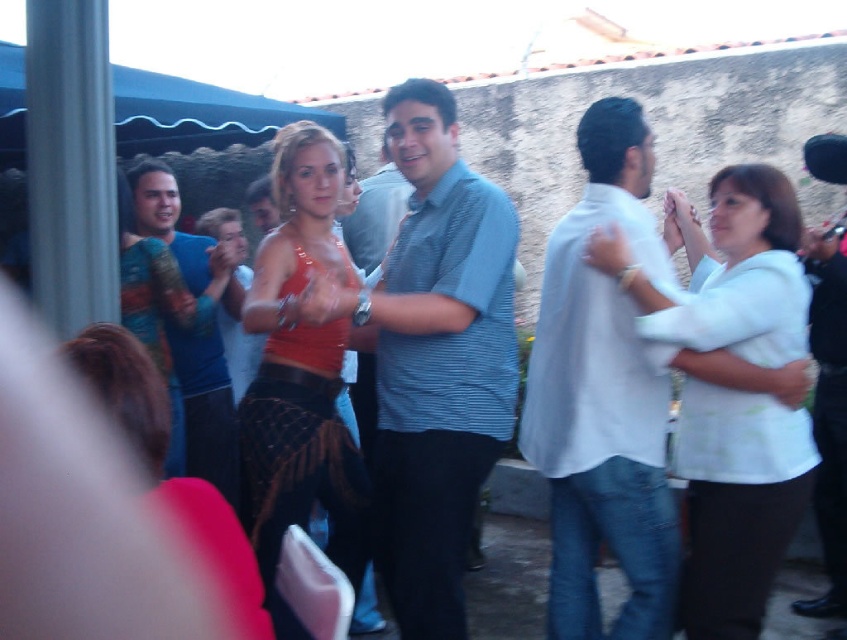
Question: Is blue striped shirt at center closer to the viewer compared to white cotton shirt at center?

Choices:
 (A) yes
 (B) no

Answer: (A)

Question: Which of the following is the closest to the observer?

Choices:
 (A) white cotton shirt at center
 (B) white matte shirt at right
 (C) blue striped shirt at center
 (D) matte orange tank top at center

Answer: (D)

Question: Which object is farther from the camera taking this photo?

Choices:
 (A) white cotton shirt at center
 (B) blue textured shirt at left

Answer: (B)

Question: Which is farther from the white matte shirt at right?

Choices:
 (A) white cotton shirt at center
 (B) blue textured shirt at left
 (C) blue striped shirt at center

Answer: (B)

Question: Can you confirm if blue striped shirt at center is positioned to the right of white matte shirt at right?

Choices:
 (A) no
 (B) yes

Answer: (A)

Question: Is white cotton shirt at center below matte orange tank top at center?

Choices:
 (A) no
 (B) yes

Answer: (B)